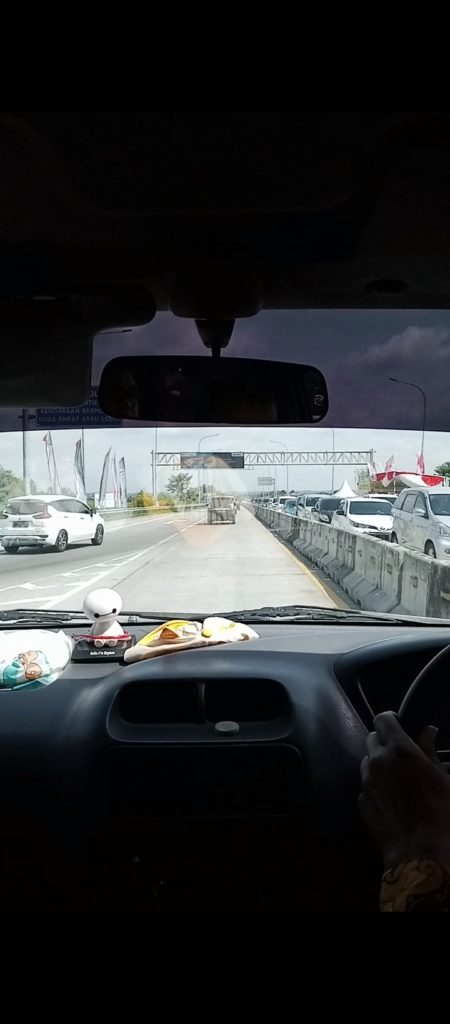
What are the coordinates of `slider button on vent` in the screenshot? It's located at (224, 725).